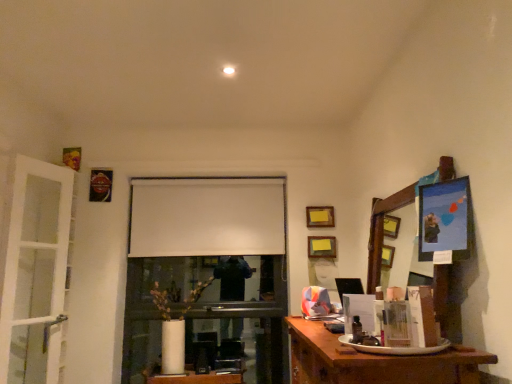
Question: In which direction should I rotate to look at wooden picture frame at upper center, which is the second picture frame in bottom-to-top order?

Choices:
 (A) left
 (B) right

Answer: (B)

Question: Is white matte projection screen at center oriented away from white glass door at left?

Choices:
 (A) no
 (B) yes

Answer: (A)

Question: Is white matte projection screen at center surrounding white glass door at left?

Choices:
 (A) yes
 (B) no

Answer: (B)

Question: Is white matte projection screen at center wider than white glass door at left?

Choices:
 (A) yes
 (B) no

Answer: (B)

Question: From a real-world perspective, is white matte projection screen at center physically above white glass door at left?

Choices:
 (A) yes
 (B) no

Answer: (A)

Question: From the image's perspective, is white matte projection screen at center on white glass door at left?

Choices:
 (A) yes
 (B) no

Answer: (A)

Question: Does white matte projection screen at center come in front of white glass door at left?

Choices:
 (A) yes
 (B) no

Answer: (B)

Question: Is the position of wooden desk at lower right less distant than that of white matte projection screen at center?

Choices:
 (A) yes
 (B) no

Answer: (A)

Question: Is wooden desk at lower right oriented towards white matte projection screen at center?

Choices:
 (A) no
 (B) yes

Answer: (A)

Question: Is wooden desk at lower right far away from white matte projection screen at center?

Choices:
 (A) yes
 (B) no

Answer: (A)

Question: Considering the relative sizes of wooden desk at lower right and white matte projection screen at center in the image provided, is wooden desk at lower right bigger than white matte projection screen at center?

Choices:
 (A) yes
 (B) no

Answer: (A)

Question: Are wooden desk at lower right and white matte projection screen at center making contact?

Choices:
 (A) no
 (B) yes

Answer: (A)

Question: Can you confirm if wooden desk at lower right is shorter than white matte projection screen at center?

Choices:
 (A) no
 (B) yes

Answer: (B)

Question: Is wooden desk at lower right beside white glass door at left?

Choices:
 (A) yes
 (B) no

Answer: (B)